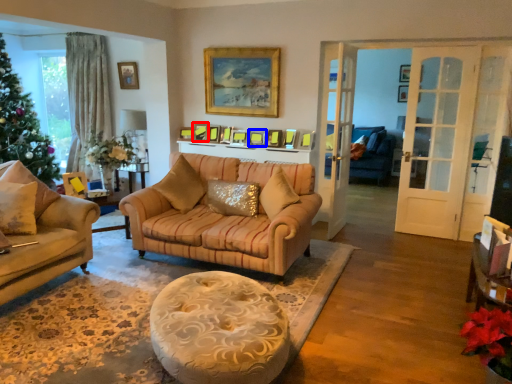
Question: Which object appears farthest to the camera in this image, picture frame (highlighted by a red box) or picture frame (highlighted by a blue box)?

Choices:
 (A) picture frame
 (B) picture frame

Answer: (A)